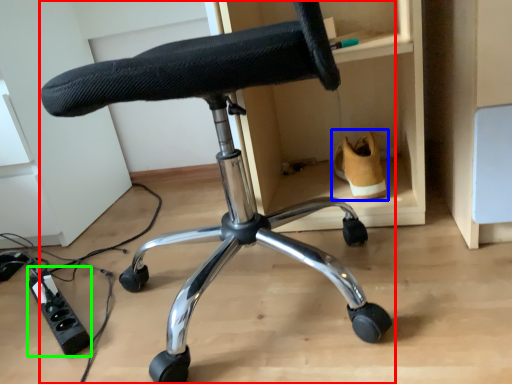
Question: Which is nearer to the chair (highlighted by a red box)? footwear (highlighted by a blue box) or plug (highlighted by a green box).

Choices:
 (A) footwear
 (B) plug

Answer: (A)